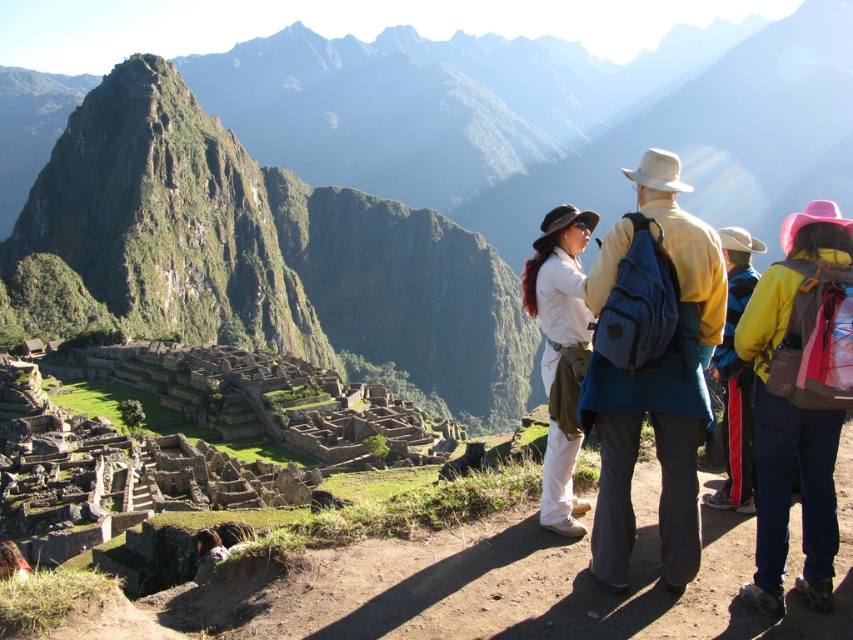
You are a tourist at Machu Picchu and want to take a photo of the green grassy mountain at center without the matte blue backpack at center appearing in the shot. How can you adjust your position to achieve this?

The green grassy mountain at center is positioned over the matte blue backpack at center. To avoid the backpack in the photo, move either to the left or right so the mountain is no longer directly above the backpack.

You are standing at the viewpoint of the image and want to take a photo of both the point at coordinates (660,179) and the point at coordinates (563,513). Since you want both points to be in focus, which point should you focus on to ensure the other is also sharp?

You should focus on the point at coordinates (563,513) because it is farther away from the camera than the point at (660,179). By focusing on the farther point, the closer point will also be within the depth of field, ensuring both are in focus.

You are a tourist standing at the viewpoint of Machu Picchu. You notice two points marked in the scene. The first point is at coordinates point (235, 116) and the second is at point (677, 365). Which point is closer to you?

Point (235, 116) is closer to you than point (677, 365) because it is further to the viewer according to the description.